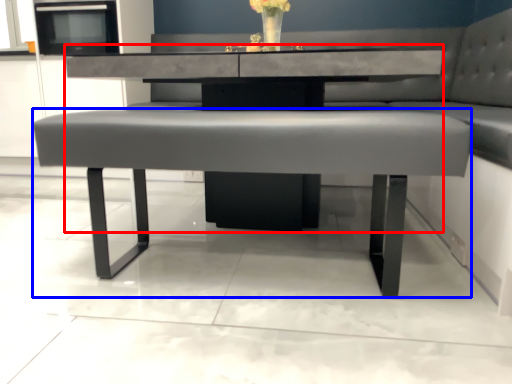
Question: Which point is further to the camera, round table (highlighted by a red box) or coffee table (highlighted by a blue box)?

Choices:
 (A) round table
 (B) coffee table

Answer: (A)